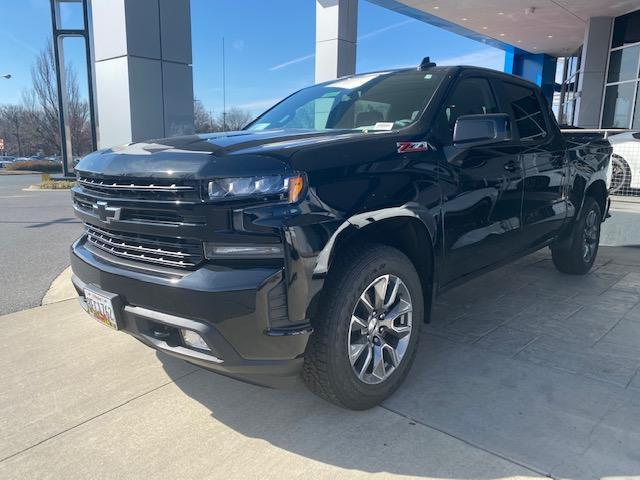
This screenshot has height=480, width=640. I want to click on window, so click(383, 103), click(457, 99), click(523, 96), click(570, 85), click(619, 81).